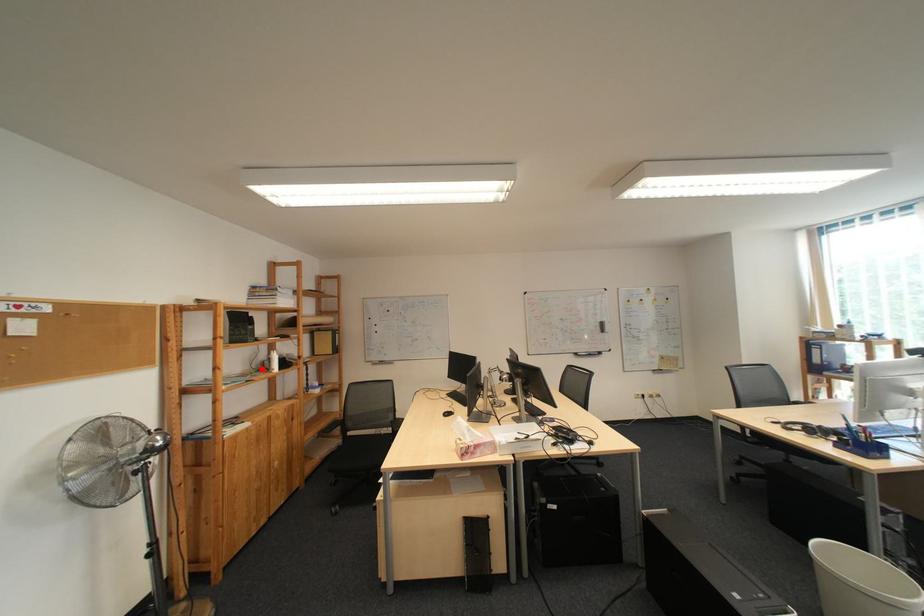
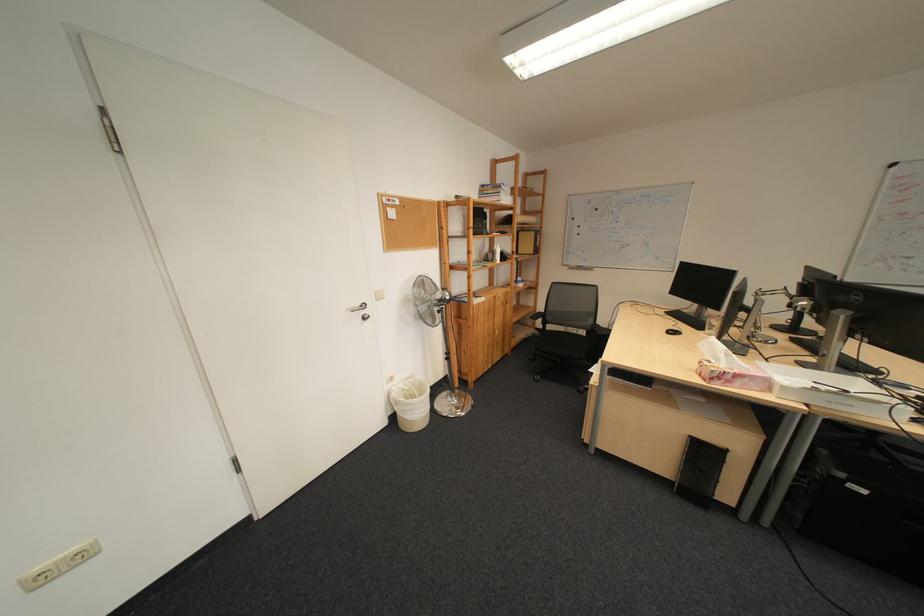
Locate, in the second image, the point that corresponds to the highlighted location in the first image.

(492, 257)